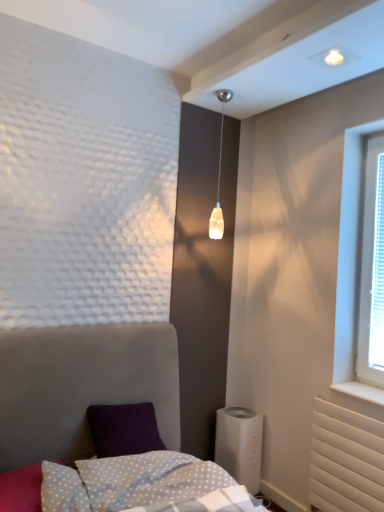
This screenshot has height=512, width=384. In order to click on white dotted fabric at lower center in this screenshot , I will do `click(110, 484)`.

This screenshot has height=512, width=384. What do you see at coordinates (110, 484) in the screenshot?
I see `white dotted fabric at lower center` at bounding box center [110, 484].

What do you see at coordinates (21, 489) in the screenshot?
I see `white dotted fabric pillow at lower left` at bounding box center [21, 489].

The image size is (384, 512). What do you see at coordinates (377, 274) in the screenshot?
I see `white plastic blinds at right` at bounding box center [377, 274].

Find the location of a particular element. The height and width of the screenshot is (512, 384). white dotted fabric at lower center is located at coordinates (110, 484).

Are translucent glass pendant light at upper center and velvet grey bed at lower left far apart?

Yes, translucent glass pendant light at upper center is far from velvet grey bed at lower left.

Is translucent glass pendant light at upper center situated inside velvet grey bed at lower left or outside?

translucent glass pendant light at upper center is not inside velvet grey bed at lower left, it's outside.

This screenshot has width=384, height=512. Find the location of `bed in front of the translucent glass pendant light at upper center`. bed in front of the translucent glass pendant light at upper center is located at coordinates pyautogui.click(x=81, y=385).

Which of these two, translucent glass pendant light at upper center or velvet grey bed at lower left, is smaller?

translucent glass pendant light at upper center.

Is white dotted fabric at lower center positioned far away from translucent glass pendant light at upper center?

Absolutely, white dotted fabric at lower center is distant from translucent glass pendant light at upper center.

Based on the photo, does white dotted fabric at lower center have a lesser width compared to translucent glass pendant light at upper center?

No, white dotted fabric at lower center is not thinner than translucent glass pendant light at upper center.

Is white dotted fabric at lower center positioned behind translucent glass pendant light at upper center?

No, it is not.

Is white dotted fabric at lower center bigger than translucent glass pendant light at upper center?

Yes, white dotted fabric at lower center is bigger than translucent glass pendant light at upper center.

Which of these two, white plastic blinds at right or white plastic humidifier at lower right, stands taller?

white plastic blinds at right is taller.

Considering the positions of point (380, 195) and point (259, 465), is point (380, 195) closer or farther from the camera than point (259, 465)?

Point (380, 195).

From the image's perspective, is white plastic blinds at right over white plastic humidifier at lower right?

Yes.

Which of these two, white plastic blinds at right or white plastic humidifier at lower right, is bigger?

white plastic humidifier at lower right.

From the picture: From a real-world perspective, who is located lower, white plastic blinds at right or translucent glass pendant light at upper center?

white plastic blinds at right.

Can you confirm if white plastic blinds at right is bigger than translucent glass pendant light at upper center?

No, white plastic blinds at right is not bigger than translucent glass pendant light at upper center.

Does white plastic blinds at right have a lesser height compared to translucent glass pendant light at upper center?

No, white plastic blinds at right is not shorter than translucent glass pendant light at upper center.

You are a GUI agent. You are given a task and a screenshot of the screen. Output one action in this format:
    pyautogui.click(x=<x>, y=<y>)
    Task: Click on the window screen that appears in front of the translucent glass pendant light at upper center
    The width and height of the screenshot is (384, 512).
    Given the screenshot: What is the action you would take?
    pyautogui.click(x=377, y=274)

From the image's perspective, between white dotted fabric pillow at lower left and white dotted fabric at lower center, which one is located above?

white dotted fabric pillow at lower left appears higher in the image.

Which is behind, point (22, 492) or point (143, 476)?

Positioned behind is point (143, 476).

Is white dotted fabric pillow at lower left positioned before white dotted fabric at lower center?

No, it is behind white dotted fabric at lower center.

I want to click on pillow above the white dotted fabric at lower center (from the image's perspective), so click(21, 489).

Is white plastic blinds at right with white dotted fabric pillow at lower left?

white plastic blinds at right and white dotted fabric pillow at lower left are not in contact.

I want to click on window screen behind the white dotted fabric pillow at lower left, so click(377, 274).

Considering the positions of objects white plastic blinds at right and white dotted fabric pillow at lower left in the image provided, who is more to the right, white plastic blinds at right or white dotted fabric pillow at lower left?

From the viewer's perspective, white plastic blinds at right appears more on the right side.

Between point (378, 324) and point (32, 477), which one is positioned in front?

The point (32, 477) is more forward.

From a real-world perspective, is white plastic humidifier at lower right positioned above or below white plastic blinds at right?

From a real-world perspective, white plastic humidifier at lower right is physically below white plastic blinds at right.

From the image's perspective, is white plastic humidifier at lower right on white plastic blinds at right?

Actually, white plastic humidifier at lower right appears below white plastic blinds at right in the image.

In the image, is white plastic humidifier at lower right positioned in front of or behind white plastic blinds at right?

Visually, white plastic humidifier at lower right is located behind white plastic blinds at right.

Is white plastic humidifier at lower right placed right next to white plastic blinds at right?

No, white plastic humidifier at lower right is not with white plastic blinds at right.

Identify the location of lamp that appears behind the velvet grey bed at lower left. (219, 176).

Where is `bedding below the translucent glass pendant light at upper center (from a real-world perspective)`? bedding below the translucent glass pendant light at upper center (from a real-world perspective) is located at coordinates point(110,484).

Which object lies further to the anchor point white plastic humidifier at lower right, white plastic blinds at right or velvet grey bed at lower left?

white plastic blinds at right lies further to white plastic humidifier at lower right than the other object.

From the image, which object appears to be nearer to white plastic blinds at right, translucent glass pendant light at upper center or white dotted fabric pillow at lower left?

translucent glass pendant light at upper center is closer to white plastic blinds at right.

Considering their positions, is white plastic blinds at right positioned further to velvet grey bed at lower left than white plastic humidifier at lower right?

Based on the image, white plastic blinds at right appears to be further to velvet grey bed at lower left.

From the image, which object appears to be farther from white plastic humidifier at lower right, white dotted fabric pillow at lower left or velvet grey bed at lower left?

white dotted fabric pillow at lower left lies further to white plastic humidifier at lower right than the other object.

Estimate the real-world distances between objects in this image. Which object is further from white dotted fabric at lower center, velvet grey bed at lower left or white dotted fabric pillow at lower left?

velvet grey bed at lower left is further to white dotted fabric at lower center.

From the image, which object appears to be nearer to translucent glass pendant light at upper center, white dotted fabric pillow at lower left or white plastic humidifier at lower right?

white plastic humidifier at lower right is positioned closer to the anchor translucent glass pendant light at upper center.

Looking at the image, which one is located closer to white dotted fabric pillow at lower left, white plastic humidifier at lower right or translucent glass pendant light at upper center?

white plastic humidifier at lower right is positioned closer to the anchor white dotted fabric pillow at lower left.

Which object lies nearer to the anchor point white plastic blinds at right, translucent glass pendant light at upper center or white plastic humidifier at lower right?

white plastic humidifier at lower right lies closer to white plastic blinds at right than the other object.

You are a GUI agent. You are given a task and a screenshot of the screen. Output one action in this format:
    pyautogui.click(x=<x>, y=<y>)
    Task: Click on the bedding located between velvet grey bed at lower left and white plastic blinds at right in the depth direction
    
    Given the screenshot: What is the action you would take?
    pyautogui.click(x=110, y=484)

You are a GUI agent. You are given a task and a screenshot of the screen. Output one action in this format:
    pyautogui.click(x=<x>, y=<y>)
    Task: Click on the pillow between velvet grey bed at lower left and white plastic blinds at right in the front-back direction
    The width and height of the screenshot is (384, 512).
    Given the screenshot: What is the action you would take?
    pyautogui.click(x=21, y=489)

The width and height of the screenshot is (384, 512). Find the location of `bedding between white dotted fabric pillow at lower left and white plastic blinds at right in the horizontal direction`. bedding between white dotted fabric pillow at lower left and white plastic blinds at right in the horizontal direction is located at coordinates (110, 484).

Locate an element on the screen. bedding between white plastic blinds at right and white plastic humidifier at lower right vertically is located at coordinates (110, 484).